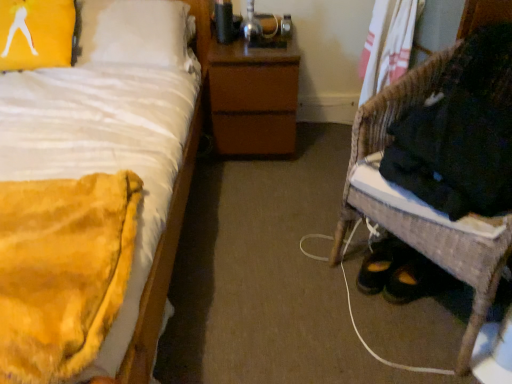
This screenshot has height=384, width=512. I want to click on vacant area to the right of brown matte nightstand at center, so click(319, 144).